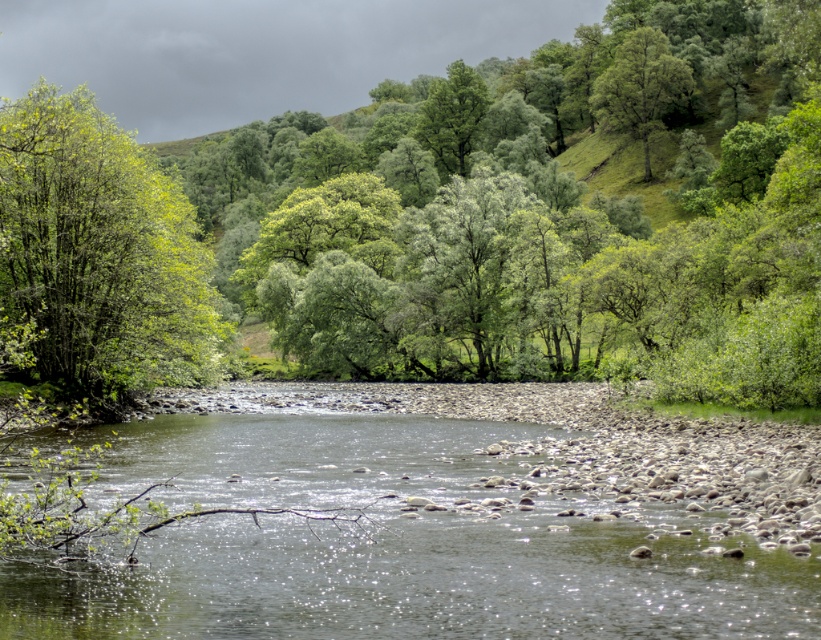
Who is lower down, clear water at center or green leafy tree at left?

Positioned lower is clear water at center.

Where is `clear water at center`? This screenshot has width=821, height=640. clear water at center is located at coordinates (398, 544).

Identify the location of clear water at center. (398, 544).

Which is behind, point (255, 268) or point (631, 624)?

Point (255, 268)

The width and height of the screenshot is (821, 640). Describe the element at coordinates (544, 212) in the screenshot. I see `green leafy tree at center` at that location.

Who is more distant from viewer, (640, 125) or (448, 611)?

Point (640, 125)

Locate an element on the screen. The width and height of the screenshot is (821, 640). green leafy tree at center is located at coordinates (544, 212).

Is clear water at center positioned in front of green leafy tree at upper right?

Yes, it is in front of green leafy tree at upper right.

Which is above, clear water at center or green leafy tree at upper right?

green leafy tree at upper right is above.

Does point (26, 577) come behind point (599, 115)?

No, (26, 577) is in front of (599, 115).

You are a GUI agent. You are given a task and a screenshot of the screen. Output one action in this format:
    pyautogui.click(x=<x>, y=<y>)
    Task: Click on the clear water at center
    
    Given the screenshot: What is the action you would take?
    coord(398,544)